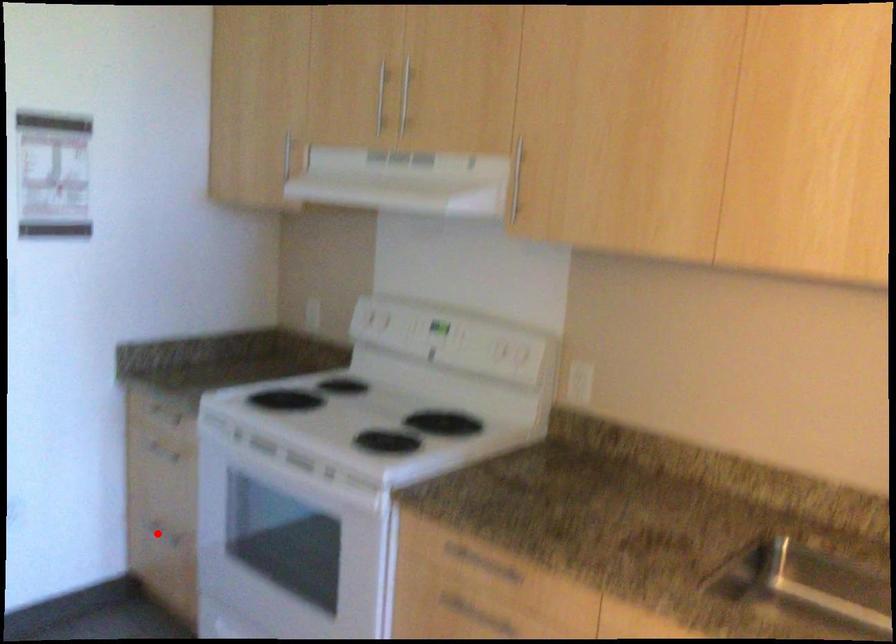
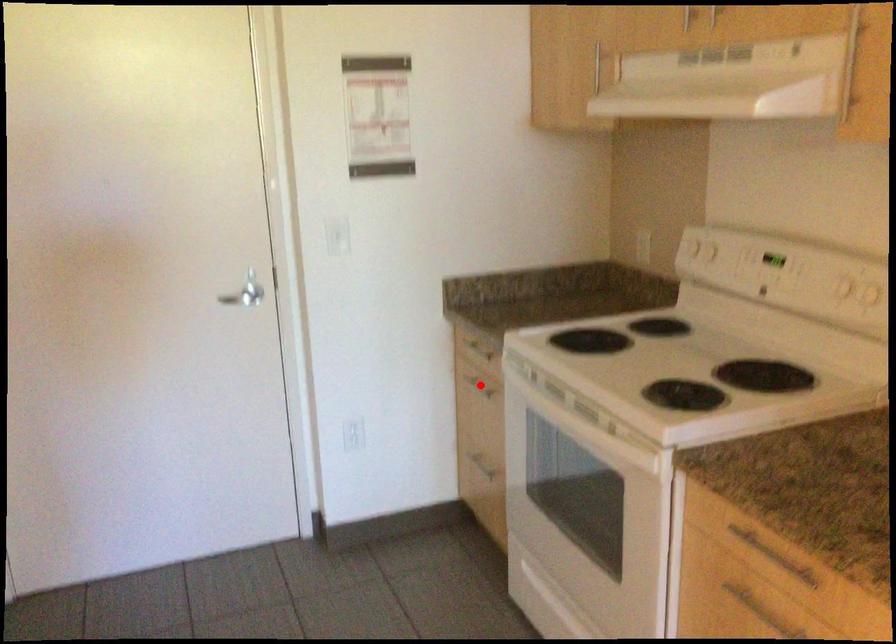
I am providing you with two images of the same scene from different viewpoints. A red point is marked on the first image and another point is marked on the second image. Is the marked point in image1 the same physical position as the marked point in image2?

No